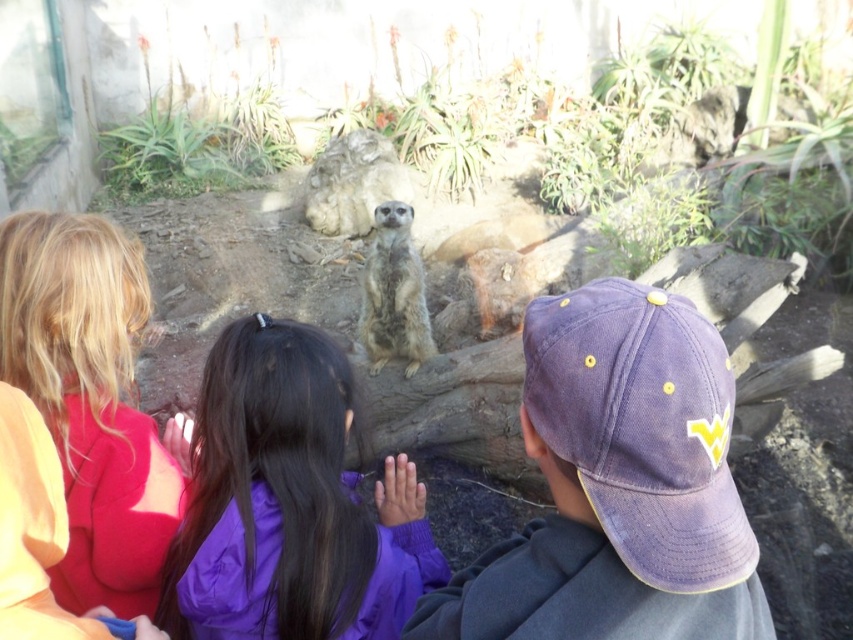
You are standing in front of the zoo exhibit and want to determine which of the two points, point (50, 570) or point (392, 356), is closer to you. Based on the scene, which point is nearer?

Point (50, 570) is closer to the viewer than point (392, 356).